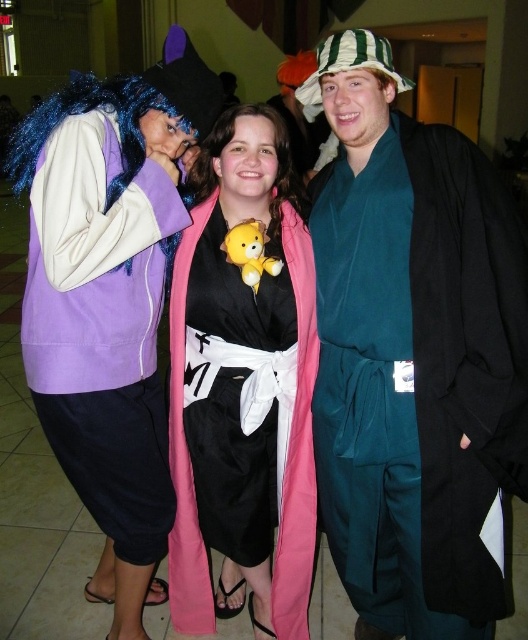
Question: Does teal silk kimono at center have a greater width compared to pink fabric teddy bear at center?

Choices:
 (A) no
 (B) yes

Answer: (B)

Question: Which point is farther to the camera?

Choices:
 (A) pink fabric teddy bear at center
 (B) purple matte jacket at left

Answer: (A)

Question: Which is nearer to the purple matte jacket at left?

Choices:
 (A) teal silk kimono at center
 (B) pink fabric teddy bear at center

Answer: (B)

Question: Is purple matte jacket at left positioned in front of pink fabric teddy bear at center?

Choices:
 (A) no
 (B) yes

Answer: (B)

Question: Can you confirm if teal silk kimono at center is bigger than purple matte jacket at left?

Choices:
 (A) no
 (B) yes

Answer: (A)

Question: Which point appears closest to the camera in this image?

Choices:
 (A) (474, 195)
 (B) (291, 236)

Answer: (A)